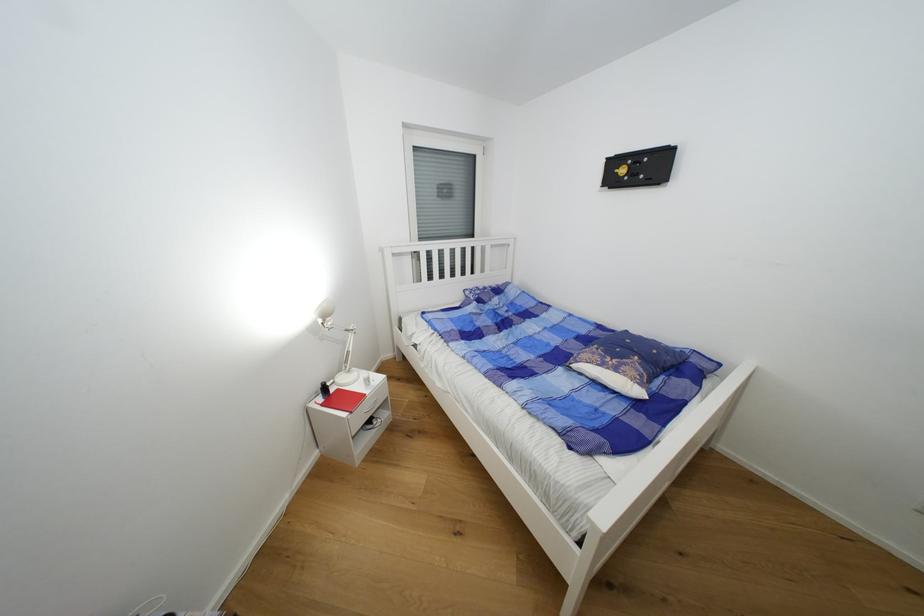
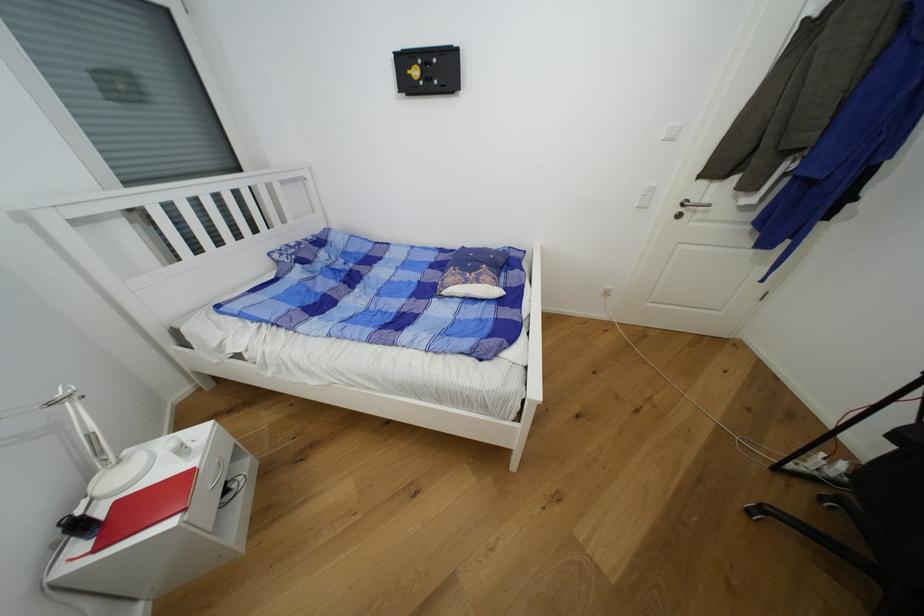
The first image is from the beginning of the video and the second image is from the end. How did the camera likely rotate when shooting the video?

The camera's rotation is toward right-down.